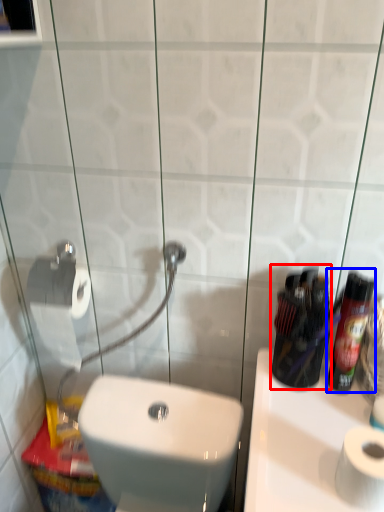
Question: Which object is further to the camera taking this photo, mouthwash (highlighted by a red box) or cleaning product (highlighted by a blue box)?

Choices:
 (A) mouthwash
 (B) cleaning product

Answer: (A)